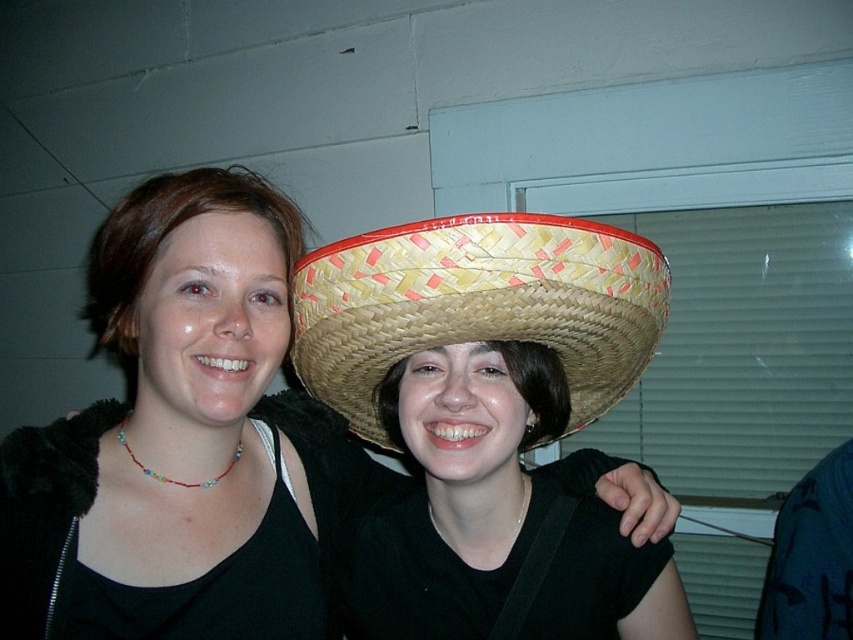
You are a photographer setting up for a portrait. You want to ensure that both the matte black tank top at center and the woven straw sombrero at center are clearly visible in the frame. Based on their positions, will the sombrero be visible without being blocked by the tank top?

The woven straw sombrero at center is behind the matte black tank top at center, so it may be partially or fully blocked from view. To ensure visibility, adjust the subjects or camera angle so the sombrero is not obscured.

You are a photographer setting up a shot for a clothing catalog. You need to ensure that the matte black tank top at center and the woven straw sombrero at center are both visible in the frame. Given their sizes, which object should you prioritize positioning closer to the camera to maintain clarity?

The matte black tank top at center is bigger than the woven straw sombrero at center, so you should prioritize positioning the woven straw sombrero at center closer to the camera to ensure it remains clear and visible in the frame.